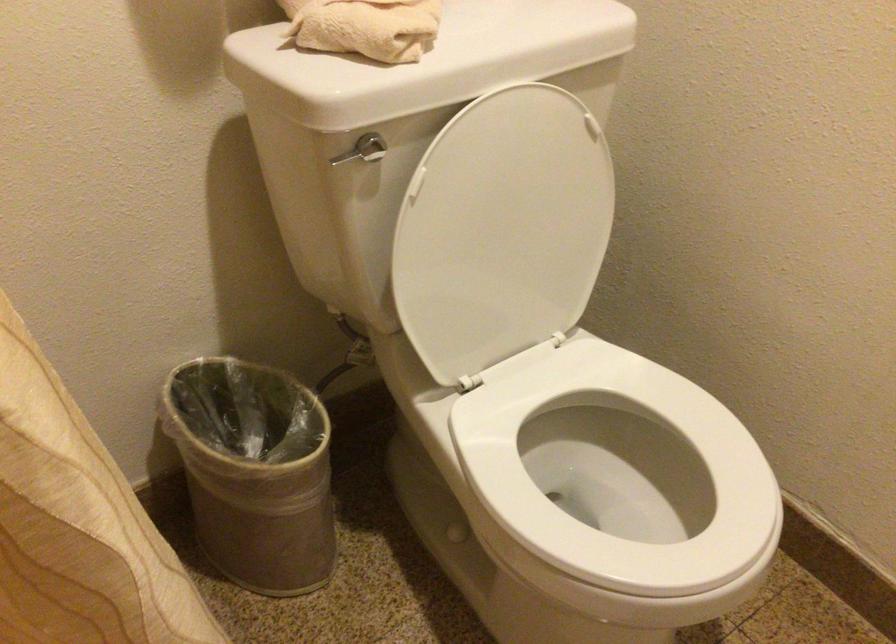
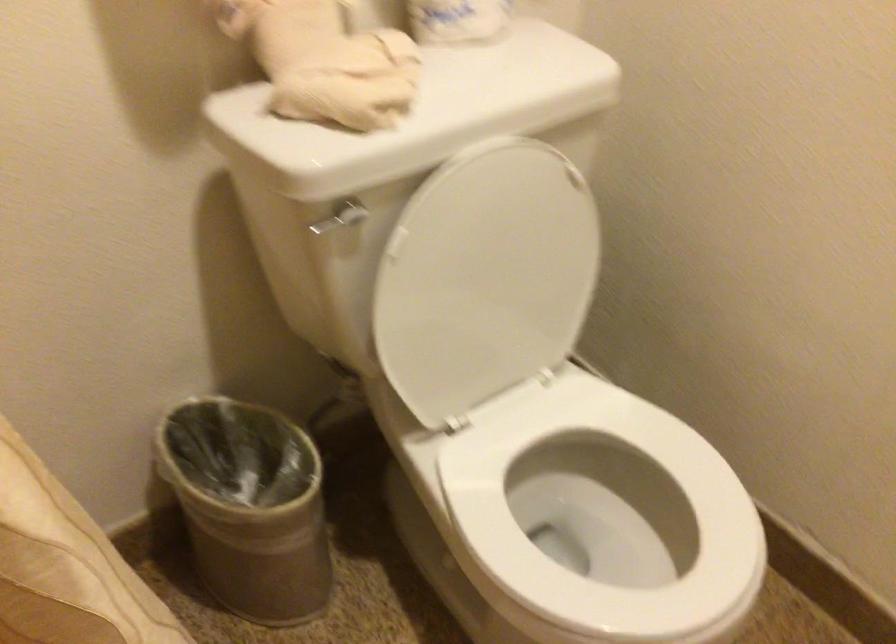
Question: The images are taken continuously from a first-person perspective. In which direction are you moving?

Choices:
 (A) Left
 (B) Right
 (C) Forward
 (D) Backward

Answer: (B)